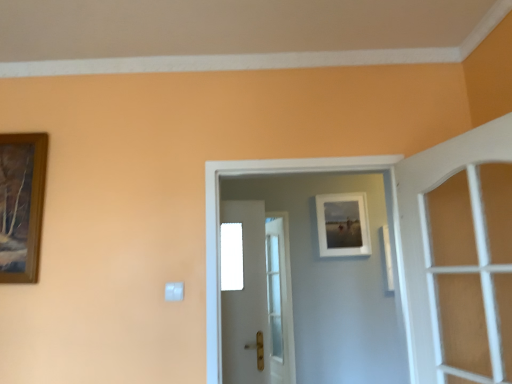
Question: Considering their positions, is white plastic light switch at lower left located in front of or behind matte white picture frame at upper center?

Choices:
 (A) behind
 (B) front

Answer: (B)

Question: From a real-world perspective, is white plastic light switch at lower left positioned above or below matte white picture frame at upper center?

Choices:
 (A) above
 (B) below

Answer: (B)

Question: Estimate the real-world distances between objects in this image. Which object is farther from the white glossy door at center, which appears as the second door when viewed from the front?

Choices:
 (A) matte white picture frame at upper center
 (B) white glossy door at center, which is the 3th door from front to back
 (C) white wooden door at right, the first door positioned from the front
 (D) white plastic light switch at lower left

Answer: (B)

Question: Which object is positioned farthest from the white wooden door at right, the first door positioned from the front?

Choices:
 (A) white plastic light switch at lower left
 (B) white glossy door at center, the 1th door in the back-to-front sequence
 (C) white glossy door at center, which appears as the second door when viewed from the front
 (D) matte white picture frame at upper center

Answer: (B)